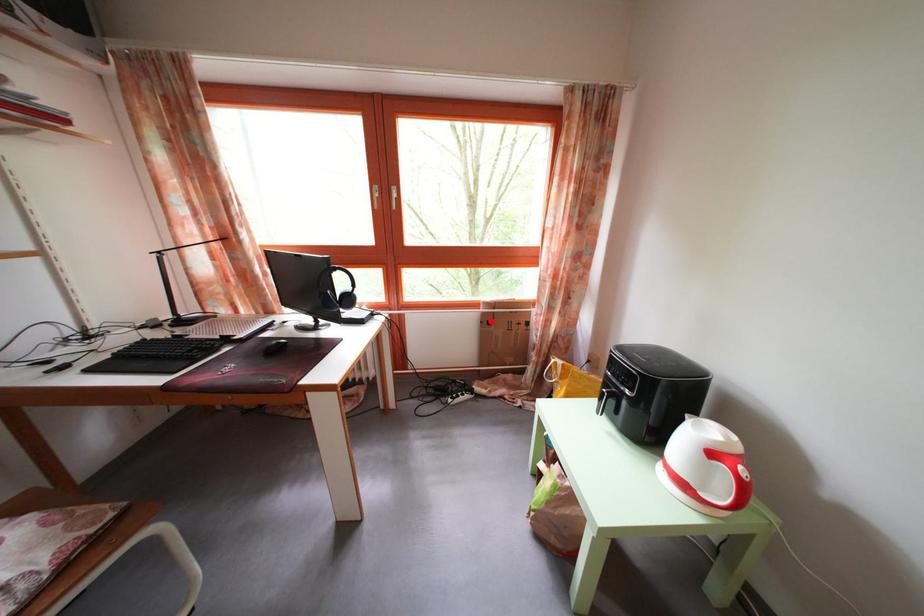
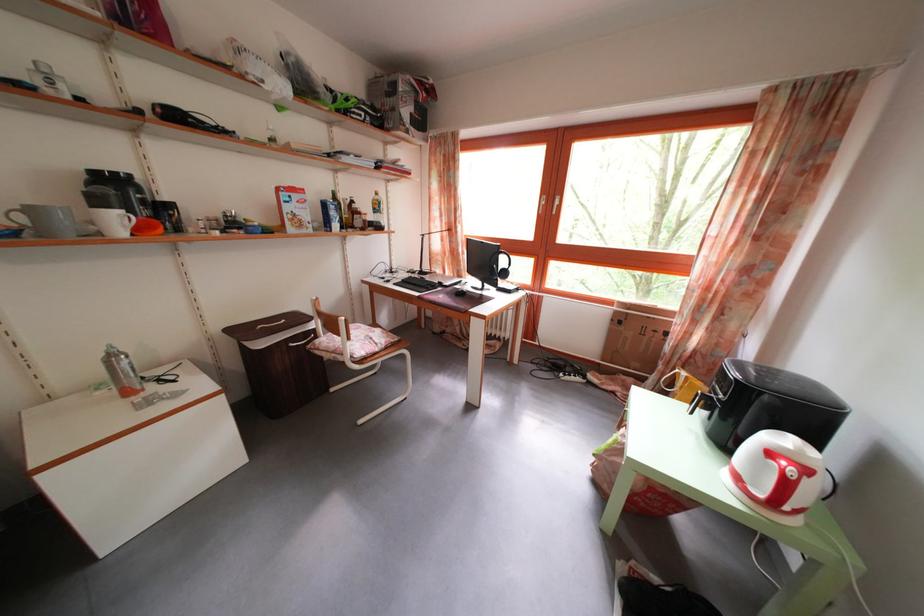
Question: I am providing you with two images of the same scene from different viewpoints. A red point is marked on the first image. At the location where the point appears in image 1, is it still visible in image 2?

Choices:
 (A) Yes
 (B) No

Answer: (A)